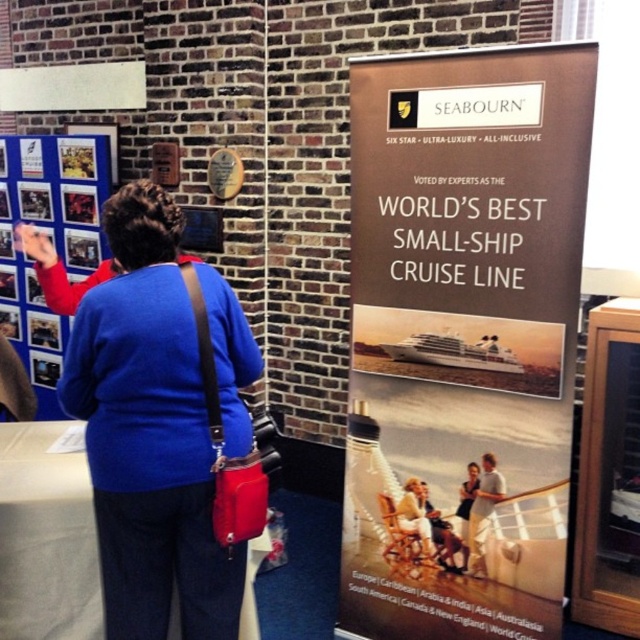
Question: Can you confirm if brown cardboard poster at right is thinner than blue fabric sweater at upper left?

Choices:
 (A) yes
 (B) no

Answer: (B)

Question: Estimate the real-world distances between objects in this image. Which object is farther from the brown cardboard poster at right?

Choices:
 (A) light brown leather jacket at center
 (B) blue fabric sweater at upper left

Answer: (B)

Question: Is the position of brown cardboard poster at right less distant than that of blue fabric sweater at upper left?

Choices:
 (A) yes
 (B) no

Answer: (B)

Question: Does light brown leather jacket at center appear on the right side of light brown leather chair at center?

Choices:
 (A) no
 (B) yes

Answer: (B)

Question: Which object is farther from the camera taking this photo?

Choices:
 (A) light brown leather chair at center
 (B) brown cardboard poster at right

Answer: (A)

Question: Based on their relative distances, which object is nearer to the light brown leather chair at center?

Choices:
 (A) blue fabric poster at upper left
 (B) blue fabric sweater at upper left
 (C) brown cardboard poster at right

Answer: (C)